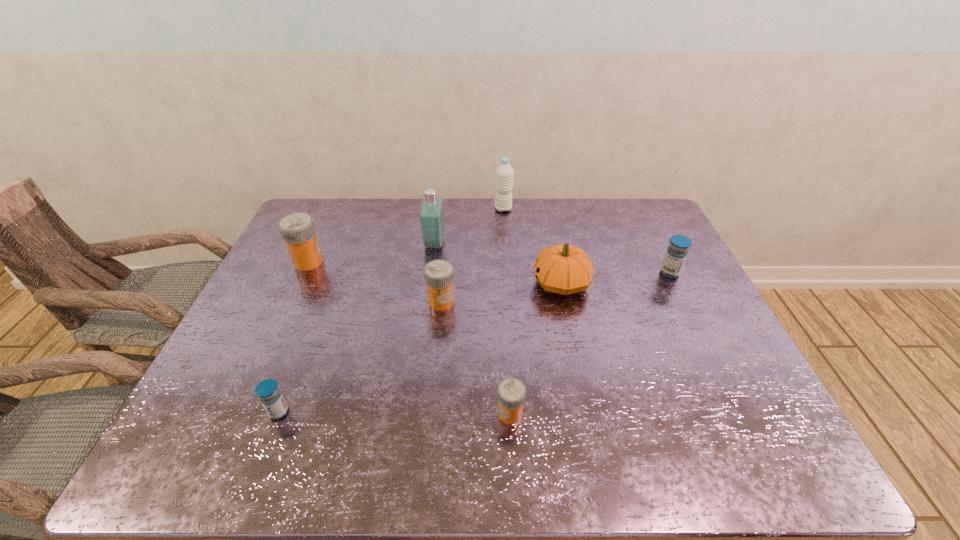
Identify which orange medicine is the closest to the right blue medicine. Please provide its 2D coordinates. Your answer should be formatted as a tuple, i.e. [(x, y)], where the tuple contains the x and y coordinates of a point satisfying the conditions above.

[(511, 391)]

This screenshot has width=960, height=540. I want to click on vacant space that satisfies the following two spatial constraints: 1. on the label side of the biggest orange medicine; 2. on the back side of the nearer blue medicine, so click(x=238, y=412).

The height and width of the screenshot is (540, 960). I want to click on vacant space that satisfies the following two spatial constraints: 1. on the front side of the rightmost medicine; 2. on the label side of the rightmost orange medicine, so click(740, 414).